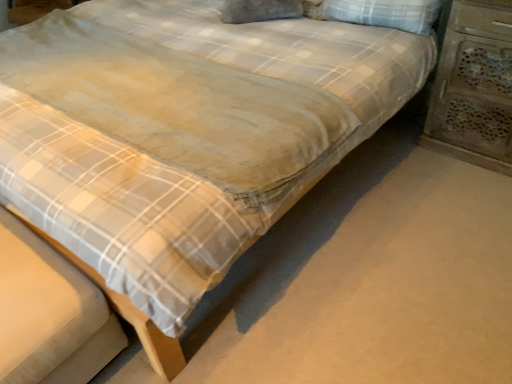
The image size is (512, 384). In order to click on vacant space situated on the left part of wooden carved nightstand at right in this screenshot , I will do `click(403, 161)`.